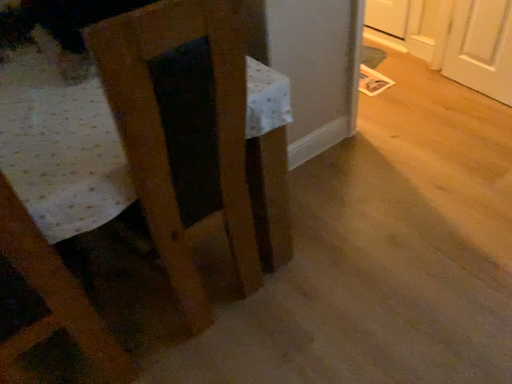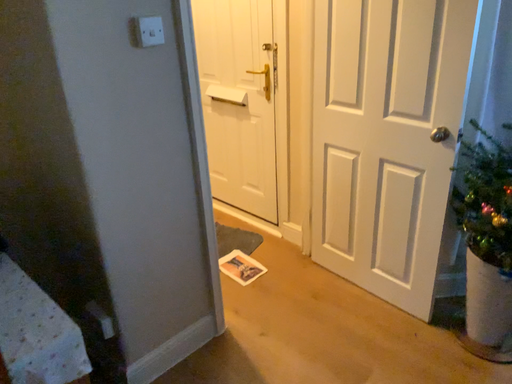
Question: How did the camera likely rotate when shooting the video?

Choices:
 (A) rotated upward
 (B) rotated downward

Answer: (A)